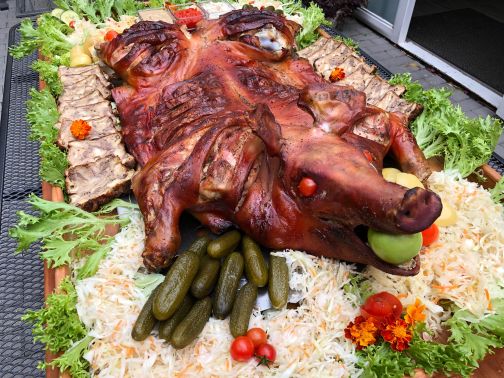
Locate an element on the screen. table is located at coordinates (12, 148).